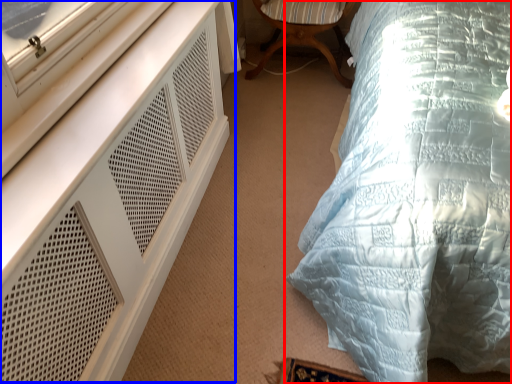
Question: Which object appears farthest to the camera in this image, bed (highlighted by a red box) or dresser (highlighted by a blue box)?

Choices:
 (A) bed
 (B) dresser

Answer: (B)